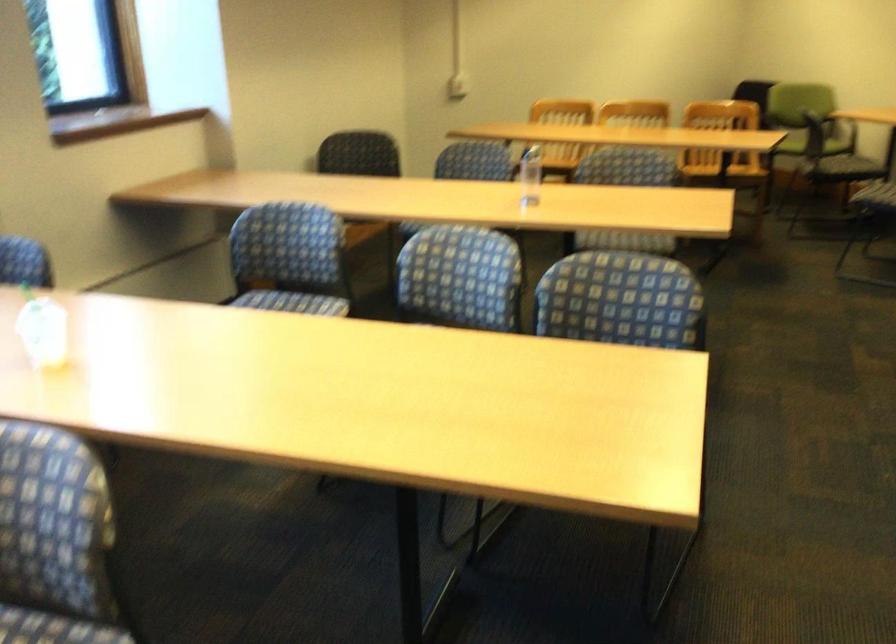
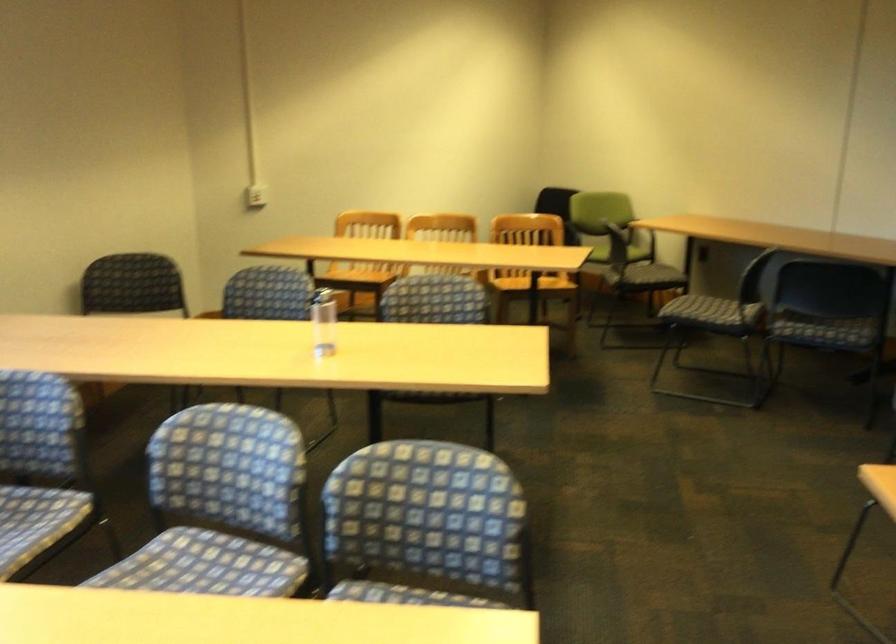
Locate, in the second image, the point that corresponds to (530,172) in the first image.

(323, 322)